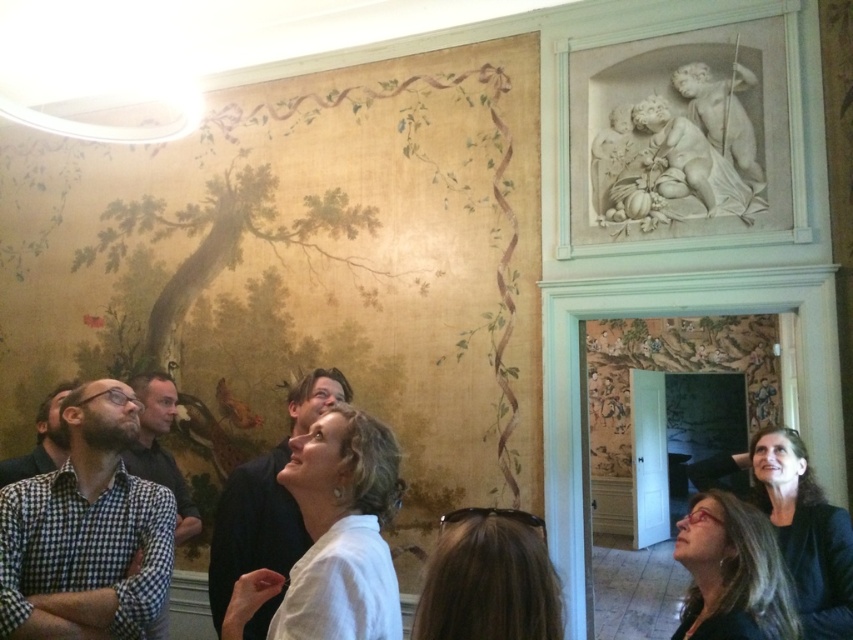
Question: Considering the real-world distances, which object is closest to the matte black jacket at lower right?

Choices:
 (A) white matte shirt at center
 (B) dark brown hair at left
 (C) brown hair at center

Answer: (A)

Question: Among these points, which one is farthest from the camera?

Choices:
 (A) (821, 614)
 (B) (369, 627)

Answer: (A)

Question: Estimate the real-world distances between objects in this image. Which object is closer to the checkered shirt at left?

Choices:
 (A) white matte shirt at center
 (B) matte black jacket at lower right
 (C) checkered shirt at center
 (D) brown hair at center

Answer: (A)

Question: Does checkered shirt at left have a smaller size compared to matte black jacket at lower right?

Choices:
 (A) yes
 (B) no

Answer: (A)

Question: From the image, what is the correct spatial relationship of matte black hair at lower right in relation to checkered shirt at center?

Choices:
 (A) above
 (B) below

Answer: (B)

Question: Can you confirm if white matte shirt at center is smaller than matte black jacket at lower right?

Choices:
 (A) no
 (B) yes

Answer: (B)